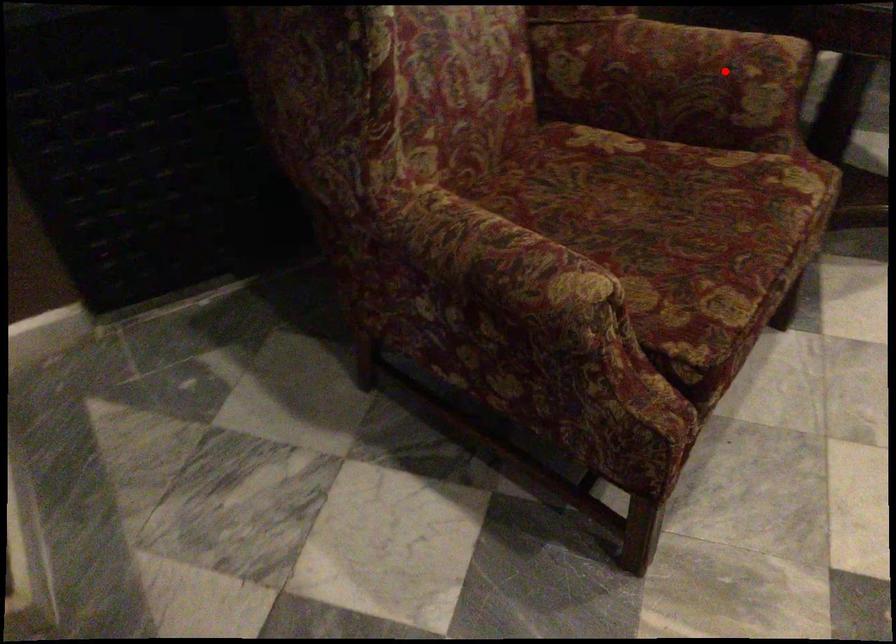
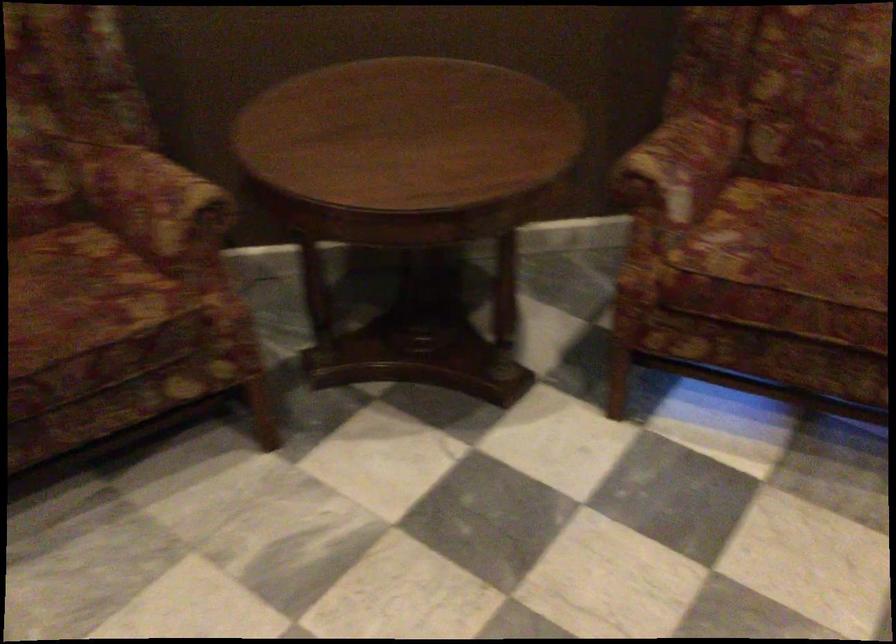
In the second image, find the point that corresponds to the highlighted location in the first image.

(156, 204)